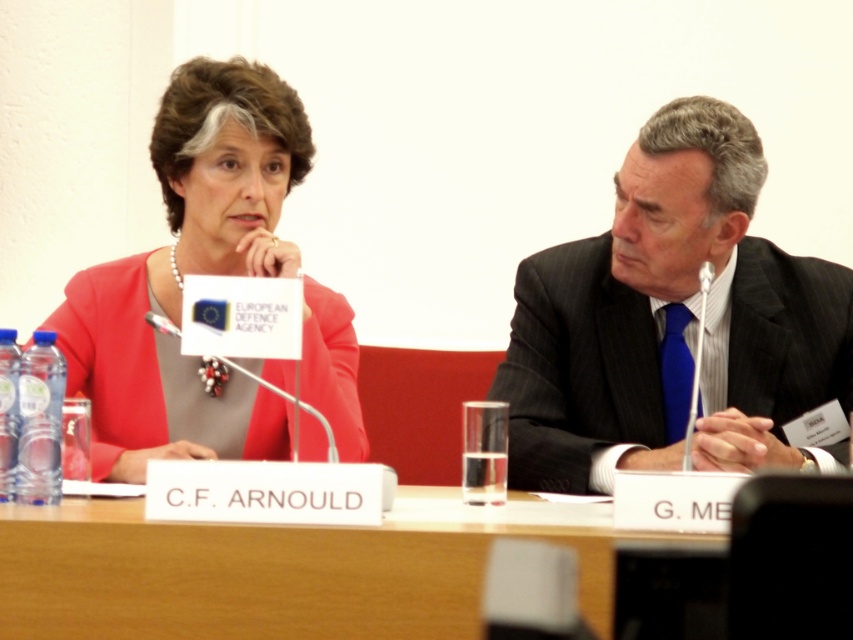
Does brown wood table at center have a larger size compared to matte pink blazer at center?

No, brown wood table at center is not bigger than matte pink blazer at center.

Who is higher up, brown wood table at center or matte pink blazer at center?

matte pink blazer at center is higher up.

Does point (143, 541) come in front of point (212, 230)?

Yes, it is.

This screenshot has height=640, width=853. What are the coordinates of `brown wood table at center` in the screenshot? It's located at (286, 570).

Between dark gray pinstripe suit at right and matte pink blazer at center, which one has less height?

Standing shorter between the two is dark gray pinstripe suit at right.

Is point (572, 276) positioned behind point (166, 435)?

Yes, it is behind point (166, 435).

The image size is (853, 640). What do you see at coordinates (672, 323) in the screenshot?
I see `dark gray pinstripe suit at right` at bounding box center [672, 323].

Where is `dark gray pinstripe suit at right`? The height and width of the screenshot is (640, 853). dark gray pinstripe suit at right is located at coordinates (672, 323).

Is dark gray pinstripe suit at right below brown wood table at center?

Actually, dark gray pinstripe suit at right is above brown wood table at center.

Between point (668, 140) and point (569, 518), which one is positioned behind?

The point (668, 140) is more distant.

Is point (592, 316) less distant than point (149, 609)?

No, it is behind (149, 609).

Identify the location of dark gray pinstripe suit at right. The width and height of the screenshot is (853, 640). (672, 323).